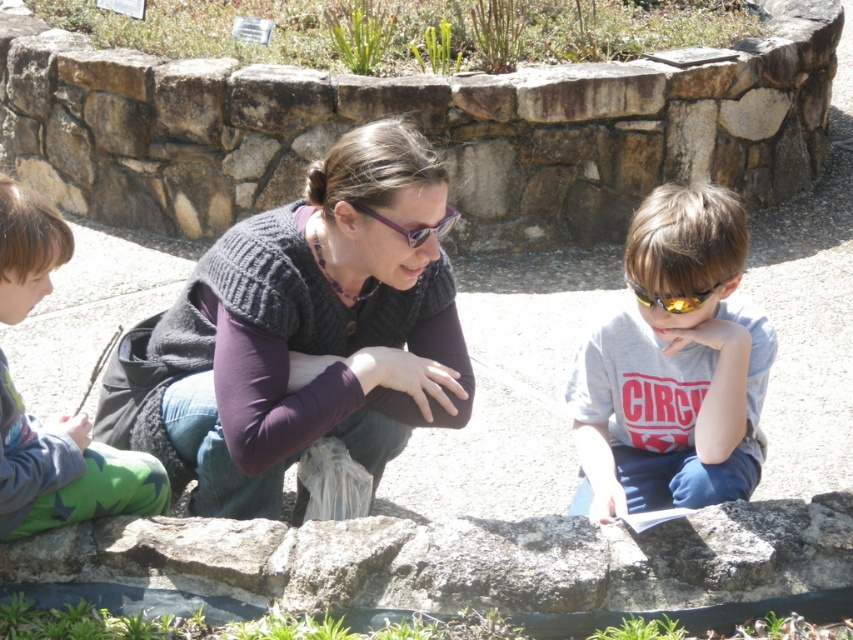
Question: Can you confirm if gray cotton shirt at center is wider than purple plastic goggles at center?

Choices:
 (A) yes
 (B) no

Answer: (A)

Question: Does brown stone wall at center lie behind green fleece pants at left?

Choices:
 (A) yes
 (B) no

Answer: (A)

Question: Which object is farther from the camera taking this photo?

Choices:
 (A) gray cotton shirt at center
 (B) brown stone wall at center

Answer: (B)

Question: Is gray cotton shirt at center to the left of yellow reflective lens sunglasses at center from the viewer's perspective?

Choices:
 (A) no
 (B) yes

Answer: (A)

Question: Based on their relative distances, which object is farther from the gray cotton shirt at center?

Choices:
 (A) purple plastic goggles at center
 (B) gray rough stone at center
 (C) yellow reflective lens sunglasses at center

Answer: (A)

Question: Among these points, which one is nearest to the camera?

Choices:
 (A) (746, 248)
 (B) (809, 88)
 (C) (1, 193)
 (D) (630, 284)

Answer: (C)